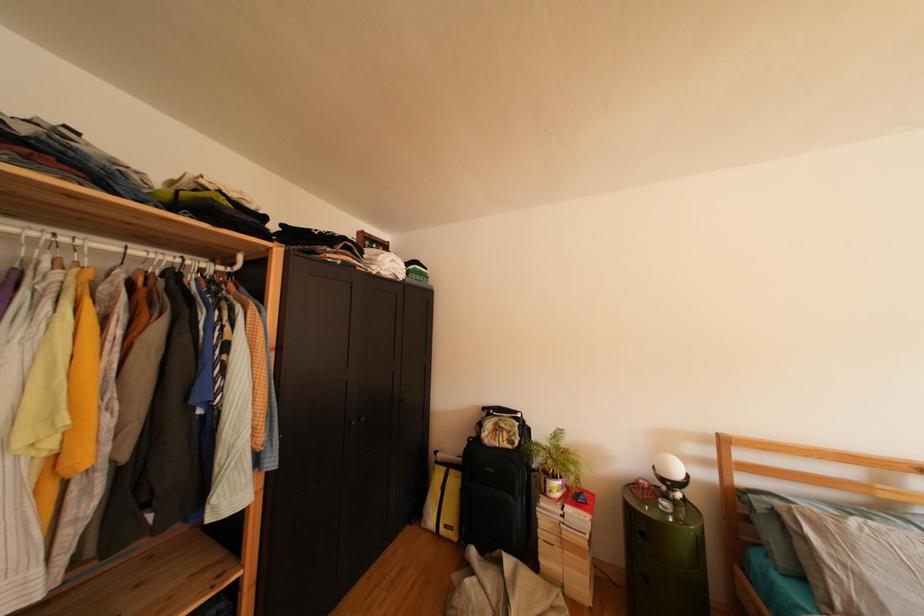
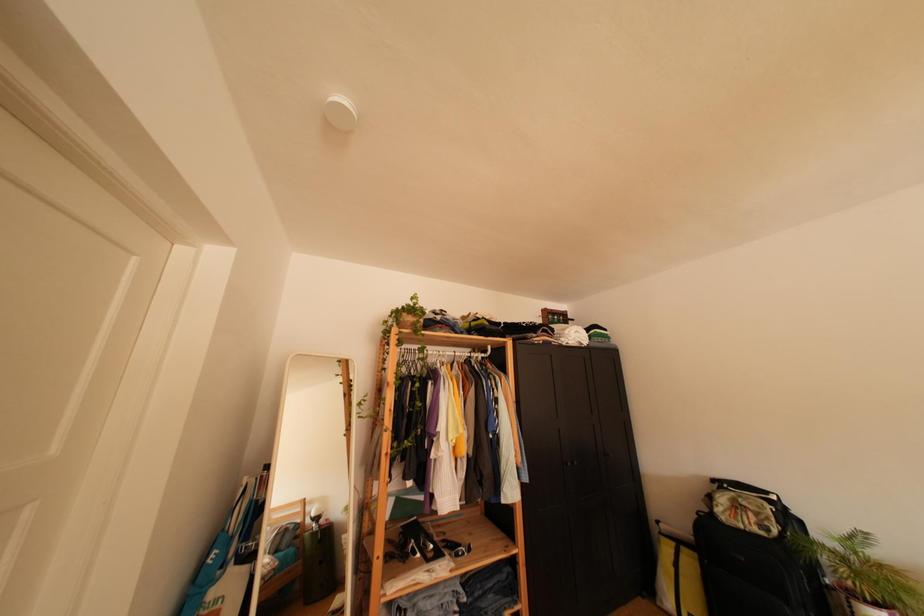
Question: The camera is either moving clockwise (left) or counter-clockwise (right) around the object. The first image is from the beginning of the video and the second image is from the end. Is the camera moving left or right when shooting the video?

Choices:
 (A) Left
 (B) Right

Answer: (B)